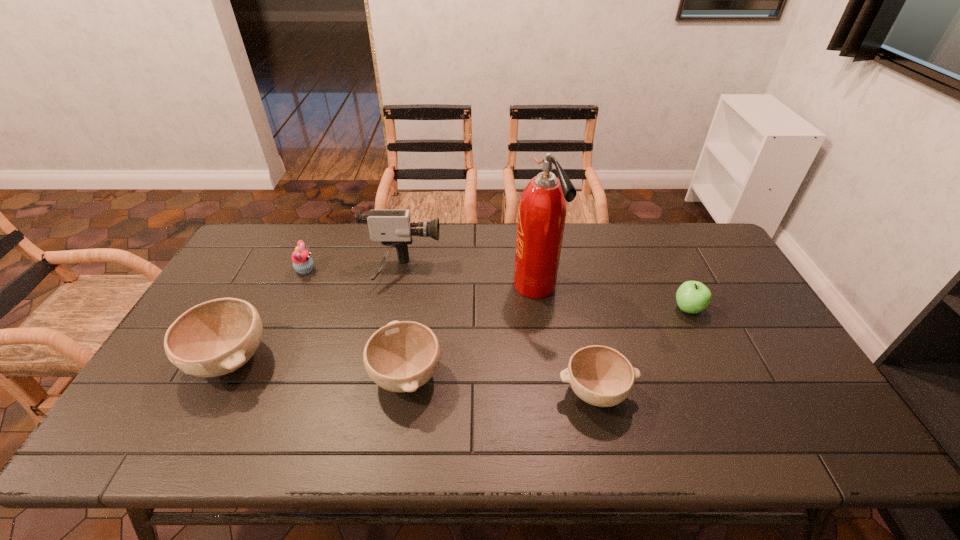
This screenshot has width=960, height=540. I want to click on free region that satisfies the following two spatial constraints: 1. on the face of the cupcake; 2. on the right side of the rightmost object, so click(x=288, y=309).

Image resolution: width=960 pixels, height=540 pixels. I want to click on blank area in the image that satisfies the following two spatial constraints: 1. on the back side of the tallest object; 2. on the face of the cupcake, so click(533, 270).